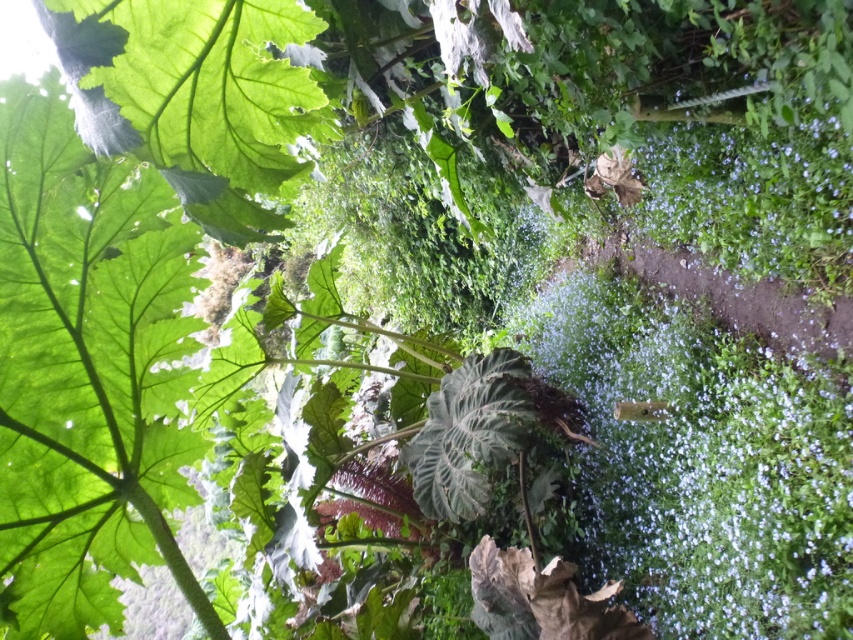
You are a drone operator trying to navigate between two points in a garden. You have to fly from the point at coordinates point (115, 243) to the point at coordinates point (440, 422). Given the garden has dense vegetation in the midground, will you be able to fly directly between these two points without hitting any obstacles?

Point (115, 243) is in front of point (440, 422), so the drone can fly directly between them as the closer point is in front and there are no obstacles mentioned between them in the scene description.

You are standing in the garden and notice two points marked in the image. Which point is nearer to you, point (809, 196) or point (438, 481)?

Point (809, 196) is closer to the viewer than point (438, 481).